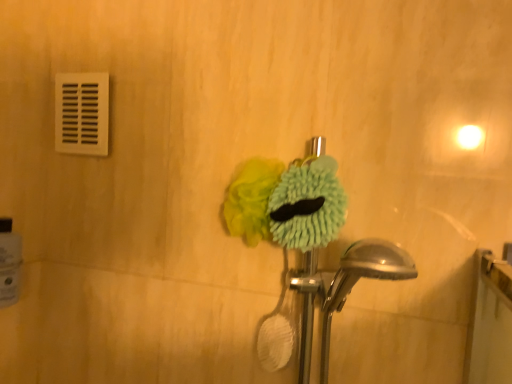
You are a GUI agent. You are given a task and a screenshot of the screen. Output one action in this format:
    pyautogui.click(x=<x>, y=<y>)
    Task: Click on the white glossy toilet paper at lower left
    
    Given the screenshot: What is the action you would take?
    pyautogui.click(x=9, y=267)

I want to click on green fuzzy brush at center, the second flower when ordered from left to right, so click(x=308, y=205).

I want to click on white glossy toilet paper at lower left, so click(9, 267).

Is white plastic vent at upper left positioned beyond the bounds of soft yellow sponge at center, the 1th flower positioned from the left?

Yes, white plastic vent at upper left is located beyond the bounds of soft yellow sponge at center, the 1th flower positioned from the left.

Is white plastic vent at upper left beside soft yellow sponge at center, the 1th flower positioned from the left?

No, white plastic vent at upper left is not making contact with soft yellow sponge at center, the 1th flower positioned from the left.

Considering the positions of objects white plastic vent at upper left and soft yellow sponge at center, the 1th flower positioned from the left, in the image provided, who is behind, white plastic vent at upper left or soft yellow sponge at center, the 1th flower positioned from the left,?

white plastic vent at upper left.

Based on their sizes in the image, would you say white plastic vent at upper left is bigger or smaller than soft yellow sponge at center, acting as the second flower starting from the right?

white plastic vent at upper left is smaller than soft yellow sponge at center, acting as the second flower starting from the right.

Consider the image. From a real-world perspective, is soft yellow sponge at center, acting as the second flower starting from the right, located beneath white glossy toilet paper at lower left?

Incorrect, from a real-world perspective, soft yellow sponge at center, acting as the second flower starting from the right, is higher than white glossy toilet paper at lower left.

Is point (279, 177) farther from viewer compared to point (1, 296)?

No, it is in front of (1, 296).

Between soft yellow sponge at center, acting as the second flower starting from the right, and white glossy toilet paper at lower left, which one has smaller size?

white glossy toilet paper at lower left.

Is soft yellow sponge at center, acting as the second flower starting from the right, turned away from white glossy toilet paper at lower left?

That's not correct — soft yellow sponge at center, acting as the second flower starting from the right, is not looking away from white glossy toilet paper at lower left.

From the image's perspective, which is below, white glossy toilet paper at lower left or white plastic vent at upper left?

white glossy toilet paper at lower left.

From the picture: Does white glossy toilet paper at lower left come behind white plastic vent at upper left?

No, white glossy toilet paper at lower left is closer to the camera.

Image resolution: width=512 pixels, height=384 pixels. I want to click on toilet paper located below the white plastic vent at upper left (from the image's perspective), so click(x=9, y=267).

Which object is thinner, white glossy toilet paper at lower left or white plastic vent at upper left?

With smaller width is white plastic vent at upper left.

Between soft yellow sponge at center, the 1th flower positioned from the left, and white plastic vent at upper left, which one has smaller width?

white plastic vent at upper left.

Is point (240, 183) in front of point (85, 148)?

That is True.

Between soft yellow sponge at center, acting as the second flower starting from the right, and white plastic vent at upper left, which one has larger size?

soft yellow sponge at center, acting as the second flower starting from the right.

From the image's perspective, is soft yellow sponge at center, acting as the second flower starting from the right, over white plastic vent at upper left?

No, from the image's perspective, soft yellow sponge at center, acting as the second flower starting from the right, is not over white plastic vent at upper left.

Is white glossy toilet paper at lower left next to green fuzzy brush at center, the second flower when ordered from left to right, and touching it?

No, white glossy toilet paper at lower left is not with green fuzzy brush at center, the second flower when ordered from left to right.

Looking at this image, could you measure the distance between white glossy toilet paper at lower left and green fuzzy brush at center, the second flower when ordered from left to right?

white glossy toilet paper at lower left and green fuzzy brush at center, the second flower when ordered from left to right, are 20.27 inches apart from each other.

Does white glossy toilet paper at lower left turn towards green fuzzy brush at center, the 1th flower viewed from the right?

Yes, white glossy toilet paper at lower left is facing green fuzzy brush at center, the 1th flower viewed from the right.

Is white glossy toilet paper at lower left inside the boundaries of green fuzzy brush at center, the 1th flower viewed from the right, or outside?

white glossy toilet paper at lower left lies outside green fuzzy brush at center, the 1th flower viewed from the right.

This screenshot has height=384, width=512. In order to click on light switch behind the green fuzzy brush at center, the 1th flower viewed from the right in this screenshot , I will do [82, 113].

From the image's perspective, would you say green fuzzy brush at center, the 1th flower viewed from the right, is positioned over white plastic vent at upper left?

No.

Between green fuzzy brush at center, the 1th flower viewed from the right, and white plastic vent at upper left, which one appears on the right side from the viewer's perspective?

green fuzzy brush at center, the 1th flower viewed from the right, is more to the right.

Considering the points (78, 95) and (6, 287), which point is behind, point (78, 95) or point (6, 287)?

The point (78, 95) is farther.

From the image's perspective, between white plastic vent at upper left and white glossy toilet paper at lower left, who is located below?

white glossy toilet paper at lower left, from the image's perspective.

Is white plastic vent at upper left in front of or behind white glossy toilet paper at lower left in the image?

white plastic vent at upper left is positioned farther from the viewer than white glossy toilet paper at lower left.

Is white plastic vent at upper left turned away from white glossy toilet paper at lower left?

white plastic vent at upper left does not have its back to white glossy toilet paper at lower left.

The width and height of the screenshot is (512, 384). I want to click on light switch that is above the soft yellow sponge at center, the 1th flower positioned from the left (from the image's perspective), so click(82, 113).

There is a white glossy toilet paper at lower left. Where is `the 1st flower above it (from a real-world perspective)`? The image size is (512, 384). the 1st flower above it (from a real-world perspective) is located at coordinates pyautogui.click(x=251, y=199).

Estimate the real-world distances between objects in this image. Which object is further from soft yellow sponge at center, the 1th flower positioned from the left, white plastic vent at upper left or white glossy toilet paper at lower left?

Among the two, white glossy toilet paper at lower left is located further to soft yellow sponge at center, the 1th flower positioned from the left.

Looking at the image, which one is located closer to green fuzzy brush at center, the second flower when ordered from left to right, white glossy toilet paper at lower left or soft yellow sponge at center, acting as the second flower starting from the right?

soft yellow sponge at center, acting as the second flower starting from the right, is closer to green fuzzy brush at center, the second flower when ordered from left to right.

Looking at the image, which one is located closer to white plastic vent at upper left, green fuzzy brush at center, the second flower when ordered from left to right, or white glossy toilet paper at lower left?

Based on the image, white glossy toilet paper at lower left appears to be nearer to white plastic vent at upper left.

Which object lies further to the anchor point white glossy toilet paper at lower left, green fuzzy brush at center, the 1th flower viewed from the right, or white plastic vent at upper left?

green fuzzy brush at center, the 1th flower viewed from the right, is positioned further to the anchor white glossy toilet paper at lower left.

Estimate the real-world distances between objects in this image. Which object is closer to green fuzzy brush at center, the 1th flower viewed from the right, white plastic vent at upper left or white glossy toilet paper at lower left?

white plastic vent at upper left is positioned closer to the anchor green fuzzy brush at center, the 1th flower viewed from the right.

Which object lies nearer to the anchor point white plastic vent at upper left, soft yellow sponge at center, the 1th flower positioned from the left, or white glossy toilet paper at lower left?

white glossy toilet paper at lower left is positioned closer to the anchor white plastic vent at upper left.

Based on their spatial positions, is soft yellow sponge at center, the 1th flower positioned from the left, or white glossy toilet paper at lower left further from green fuzzy brush at center, the 1th flower viewed from the right?

white glossy toilet paper at lower left is positioned further to the anchor green fuzzy brush at center, the 1th flower viewed from the right.

When comparing their distances from white glossy toilet paper at lower left, does soft yellow sponge at center, the 1th flower positioned from the left, or green fuzzy brush at center, the second flower when ordered from left to right, seem further?

green fuzzy brush at center, the second flower when ordered from left to right, is further to white glossy toilet paper at lower left.

This screenshot has width=512, height=384. In order to click on flower between white glossy toilet paper at lower left and green fuzzy brush at center, the 1th flower viewed from the right, from left to right in this screenshot , I will do `click(251, 199)`.

At what (x,y) coordinates should I click in order to perform the action: click on light switch between white glossy toilet paper at lower left and soft yellow sponge at center, the 1th flower positioned from the left, from left to right. Please return your answer as a coordinate pair (x, y). Looking at the image, I should click on (82, 113).

This screenshot has width=512, height=384. Identify the location of flower located between white plastic vent at upper left and green fuzzy brush at center, the 1th flower viewed from the right, in the left-right direction. (251, 199).

Identify the location of light switch between white glossy toilet paper at lower left and green fuzzy brush at center, the second flower when ordered from left to right, from left to right. (82, 113).